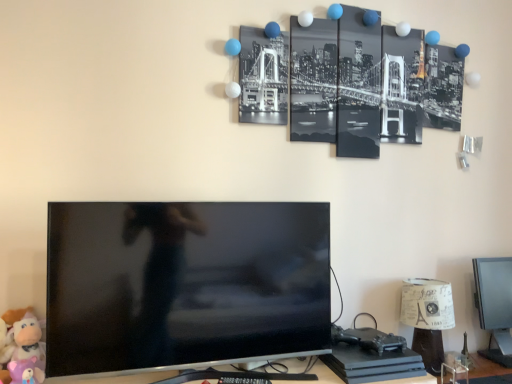
The height and width of the screenshot is (384, 512). What do you see at coordinates (184, 284) in the screenshot?
I see `black glossy tv at center` at bounding box center [184, 284].

What is the approximate width of matte black monitor at lower right?

matte black monitor at lower right is 20.12 centimeters in width.

The width and height of the screenshot is (512, 384). I want to click on black glossy tv at center, so click(184, 284).

Looking at this image, from the image's perspective, is black glossy tv at center located above or below plush purple bear at lower left, which ranks as the first toy in front-to-back order?

black glossy tv at center is situated higher than plush purple bear at lower left, which ranks as the first toy in front-to-back order, in the image.

Is black glossy tv at center shorter than plush purple bear at lower left, which ranks as the 2th toy in back-to-front order?

No, black glossy tv at center is not shorter than plush purple bear at lower left, which ranks as the 2th toy in back-to-front order.

Based on their sizes in the image, would you say black glossy tv at center is bigger or smaller than plush purple bear at lower left, which ranks as the first toy in front-to-back order?

Considering their sizes, black glossy tv at center takes up more space than plush purple bear at lower left, which ranks as the first toy in front-to-back order.

Is black glossy tv at center next to plush purple bear at lower left, which ranks as the 2th toy in back-to-front order, and touching it?

No, black glossy tv at center is not touching plush purple bear at lower left, which ranks as the 2th toy in back-to-front order.

Does soft plush toy at lower left, placed as the second toy when sorted from front to back, have a lesser width compared to paper lampshade at lower right?

Yes, soft plush toy at lower left, placed as the second toy when sorted from front to back, is thinner than paper lampshade at lower right.

From a real-world perspective, is soft plush toy at lower left, placed as the first toy when sorted from back to front, under paper lampshade at lower right?

Actually, soft plush toy at lower left, placed as the first toy when sorted from back to front, is physically above paper lampshade at lower right in the real world.

Locate an element on the screen. toy located above the paper lampshade at lower right (from the image's perspective) is located at coordinates (25, 351).

Is the depth of soft plush toy at lower left, placed as the second toy when sorted from front to back, greater than that of paper lampshade at lower right?

No, soft plush toy at lower left, placed as the second toy when sorted from front to back, is in front of paper lampshade at lower right.

Which object is positioned more to the left, matte black monitor at lower right or paper lampshade at lower right?

paper lampshade at lower right is more to the left.

Looking at this image, who is smaller, matte black monitor at lower right or paper lampshade at lower right?

paper lampshade at lower right.

Are matte black monitor at lower right and paper lampshade at lower right far apart?

matte black monitor at lower right is actually quite close to paper lampshade at lower right.

Considering the relative sizes of matte black monitor at lower right and paper lampshade at lower right in the image provided, is matte black monitor at lower right thinner than paper lampshade at lower right?

Yes.

From the image's perspective, which is above, matte black monitor at lower right or black glossy tv at center?

black glossy tv at center is shown above in the image.

From a real-world perspective, is matte black monitor at lower right positioned above or below black glossy tv at center?

matte black monitor at lower right is situated lower than black glossy tv at center in the real world.

Who is shorter, matte black monitor at lower right or black glossy tv at center?

With less height is matte black monitor at lower right.

Based on their positions, is matte black monitor at lower right located to the left or right of black glossy tv at center?

matte black monitor at lower right is positioned on black glossy tv at center's right side.

Which point is more forward, [507,356] or [38,382]?

The point [38,382] is closer to the camera.

Considering the positions of objects matte black monitor at lower right and plush purple bear at lower left, which ranks as the first toy in front-to-back order, in the image provided, who is in front, matte black monitor at lower right or plush purple bear at lower left, which ranks as the first toy in front-to-back order,?

plush purple bear at lower left, which ranks as the first toy in front-to-back order, is more forward.

Is matte black monitor at lower right placed right next to plush purple bear at lower left, which ranks as the 2th toy in back-to-front order?

matte black monitor at lower right and plush purple bear at lower left, which ranks as the 2th toy in back-to-front order, are clearly separated.

How much distance is there between matte black monitor at lower right and plush purple bear at lower left, which ranks as the 2th toy in back-to-front order?

The distance of matte black monitor at lower right from plush purple bear at lower left, which ranks as the 2th toy in back-to-front order, is 5.79 feet.

From a real-world perspective, relative to plush purple bear at lower left, which ranks as the first toy in front-to-back order, is paper lampshade at lower right vertically above or below?

paper lampshade at lower right is situated higher than plush purple bear at lower left, which ranks as the first toy in front-to-back order, in the real world.

Could you tell me if paper lampshade at lower right is turned towards plush purple bear at lower left, which ranks as the first toy in front-to-back order?

No, paper lampshade at lower right is not aimed at plush purple bear at lower left, which ranks as the first toy in front-to-back order.

Image resolution: width=512 pixels, height=384 pixels. Find the location of `table lamp that is on the right side of plush purple bear at lower left, which ranks as the first toy in front-to-back order`. table lamp that is on the right side of plush purple bear at lower left, which ranks as the first toy in front-to-back order is located at coordinates (428, 317).

From a real-world perspective, is paper lampshade at lower right over soft plush toy at lower left, placed as the first toy when sorted from back to front?

No, from a real-world perspective, paper lampshade at lower right is not above soft plush toy at lower left, placed as the first toy when sorted from back to front.

Does paper lampshade at lower right contain soft plush toy at lower left, placed as the first toy when sorted from back to front?

No, soft plush toy at lower left, placed as the first toy when sorted from back to front, is not a part of paper lampshade at lower right.

Is paper lampshade at lower right in contact with soft plush toy at lower left, placed as the second toy when sorted from front to back?

No, paper lampshade at lower right is not beside soft plush toy at lower left, placed as the second toy when sorted from front to back.

Is point (436, 324) in front of point (10, 344)?

No, it is behind (10, 344).

Where is `television located on the right of plush purple bear at lower left, which ranks as the first toy in front-to-back order`? The image size is (512, 384). television located on the right of plush purple bear at lower left, which ranks as the first toy in front-to-back order is located at coordinates (184, 284).

Identify the location of the 2nd toy to the left of the paper lampshade at lower right, starting your count from the anchor. (25, 351).

Which object lies nearer to the anchor point soft plush toy at lower left, placed as the first toy when sorted from back to front, plush purple bear at lower left, which ranks as the 2th toy in back-to-front order, or matte black monitor at lower right?

Based on the image, plush purple bear at lower left, which ranks as the 2th toy in back-to-front order, appears to be nearer to soft plush toy at lower left, placed as the first toy when sorted from back to front.

From the image, which object appears to be nearer to soft plush toy at lower left, placed as the first toy when sorted from back to front, black glossy tv at center or paper lampshade at lower right?

black glossy tv at center is positioned closer to the anchor soft plush toy at lower left, placed as the first toy when sorted from back to front.

When comparing their distances from matte black monitor at lower right, does black glossy tv at center or plush purple bear at lower left, which ranks as the first toy in front-to-back order, seem closer?

black glossy tv at center is positioned closer to the anchor matte black monitor at lower right.

When comparing their distances from paper lampshade at lower right, does matte black monitor at lower right or black glossy tv at center seem further?

The object further to paper lampshade at lower right is black glossy tv at center.

When comparing their distances from black glossy tv at center, does soft plush toy at lower left, placed as the first toy when sorted from back to front, or plush purple bear at lower left, which ranks as the 2th toy in back-to-front order, seem further?

Based on the image, plush purple bear at lower left, which ranks as the 2th toy in back-to-front order, appears to be further to black glossy tv at center.

Looking at this image, considering their positions, is plush purple bear at lower left, which ranks as the 2th toy in back-to-front order, positioned closer to paper lampshade at lower right than soft plush toy at lower left, placed as the second toy when sorted from front to back?

Based on the image, soft plush toy at lower left, placed as the second toy when sorted from front to back, appears to be nearer to paper lampshade at lower right.

From the image, which object appears to be farther from plush purple bear at lower left, which ranks as the first toy in front-to-back order, matte black monitor at lower right or paper lampshade at lower right?

matte black monitor at lower right is further to plush purple bear at lower left, which ranks as the first toy in front-to-back order.

Which object lies nearer to the anchor point plush purple bear at lower left, which ranks as the first toy in front-to-back order, paper lampshade at lower right or matte black monitor at lower right?

The object closer to plush purple bear at lower left, which ranks as the first toy in front-to-back order, is paper lampshade at lower right.

Where is `table lamp between plush purple bear at lower left, which ranks as the first toy in front-to-back order, and matte black monitor at lower right from left to right`? Image resolution: width=512 pixels, height=384 pixels. table lamp between plush purple bear at lower left, which ranks as the first toy in front-to-back order, and matte black monitor at lower right from left to right is located at coordinates (428, 317).

Identify the location of television situated between plush purple bear at lower left, which ranks as the 2th toy in back-to-front order, and matte black monitor at lower right from left to right. (184, 284).

The image size is (512, 384). I want to click on toy between soft plush toy at lower left, placed as the second toy when sorted from front to back, and black glossy tv at center, in the horizontal direction, so click(25, 371).

Locate an element on the screen. Image resolution: width=512 pixels, height=384 pixels. television between soft plush toy at lower left, placed as the first toy when sorted from back to front, and matte black monitor at lower right is located at coordinates (184, 284).